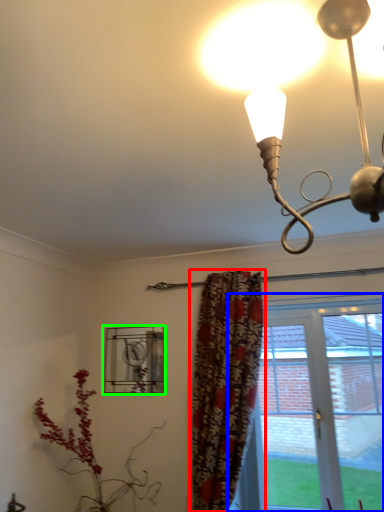
Question: Which object is positioned closest to curtain (highlighted by a red box)? Select from window (highlighted by a blue box) and window (highlighted by a green box).

Choices:
 (A) window
 (B) window

Answer: (A)